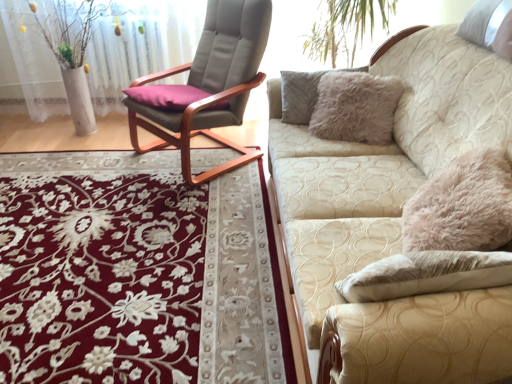
Question: From their relative heights in the image, would you say matte gray cushioned chair at center is taller or shorter than beige textured couch at right?

Choices:
 (A) short
 (B) tall

Answer: (B)

Question: Considering the relative positions of matte gray cushioned chair at center and beige textured couch at right in the image provided, is matte gray cushioned chair at center to the left or to the right of beige textured couch at right?

Choices:
 (A) left
 (B) right

Answer: (A)

Question: Which object is positioned closest to the matte gray cushioned chair at center?

Choices:
 (A) beige textured couch at right
 (B) white matte vase at left
 (C) floral carpet at center

Answer: (B)

Question: Based on their relative distances, which object is farther from the white matte vase at left?

Choices:
 (A) matte gray cushioned chair at center
 (B) beige textured couch at right
 (C) floral carpet at center

Answer: (B)